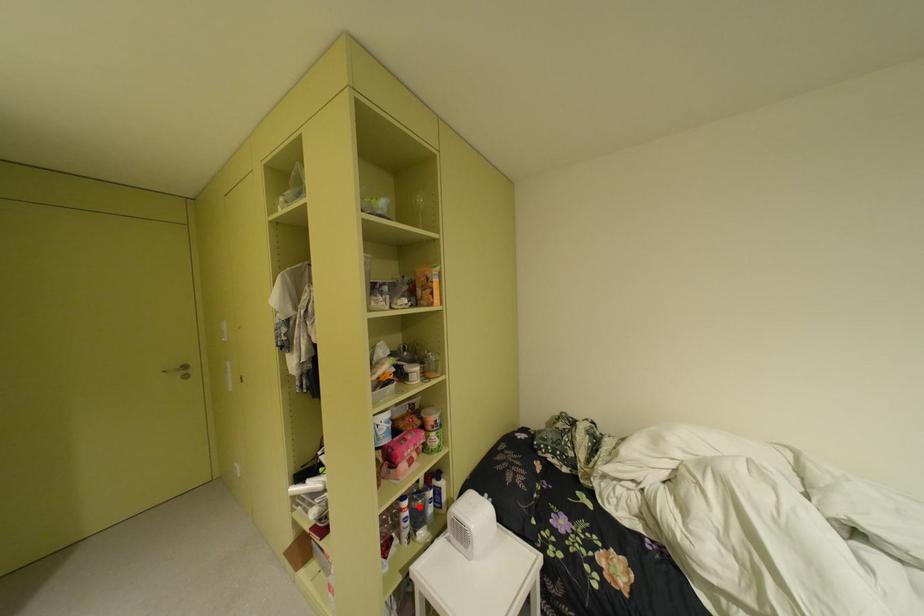
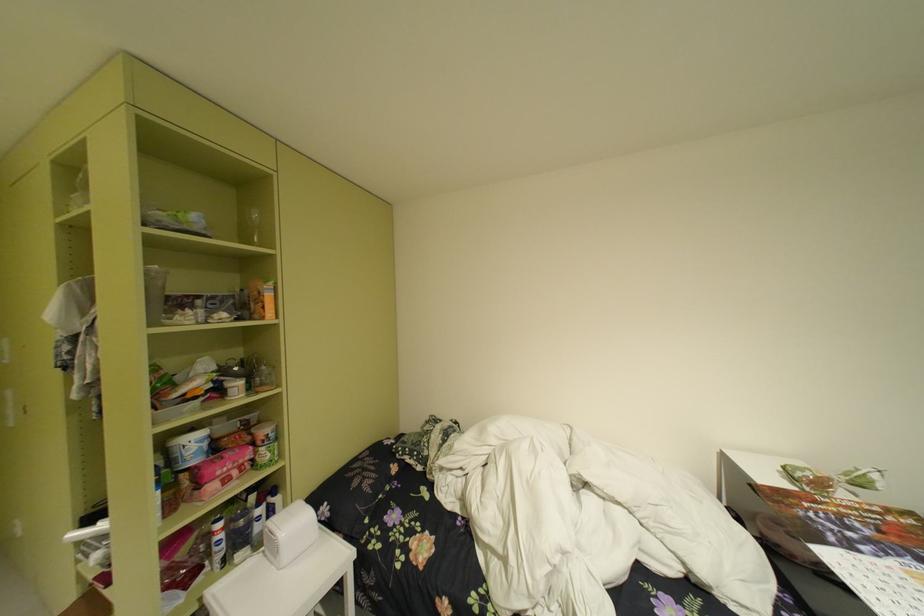
In the second image, find the point that corresponds to the highlighted location in the first image.

(235, 528)